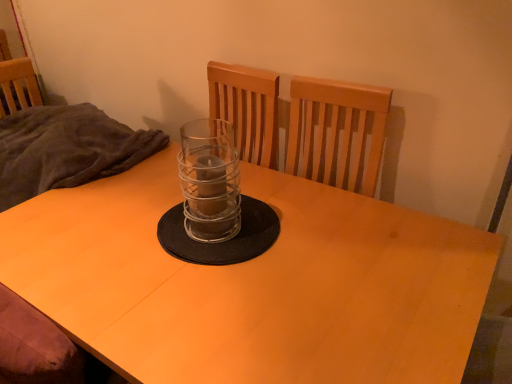
Where is `vacant area that is situated to the right of clear glass candle holder at center`? This screenshot has width=512, height=384. vacant area that is situated to the right of clear glass candle holder at center is located at coordinates (304, 232).